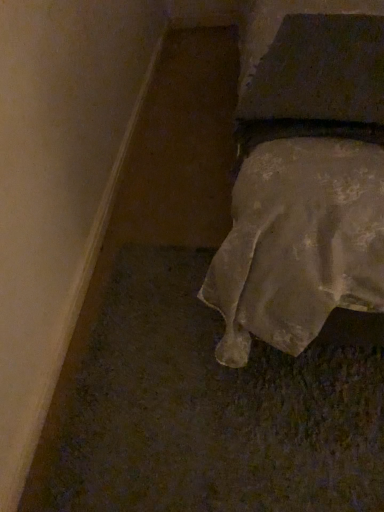
The height and width of the screenshot is (512, 384). What do you see at coordinates (312, 61) in the screenshot? I see `dark gray fabric pillow at upper right` at bounding box center [312, 61].

I want to click on dark gray fabric pillow at upper right, so click(x=312, y=61).

What is the approximate height of dark gray fabric pillow at upper right?

The height of dark gray fabric pillow at upper right is 8.35 centimeters.

At what (x,y) coordinates should I click in order to perform the action: click on dark gray fabric pillow at upper right. Please return your answer as a coordinate pair (x, y). The image size is (384, 512). Looking at the image, I should click on (312, 61).